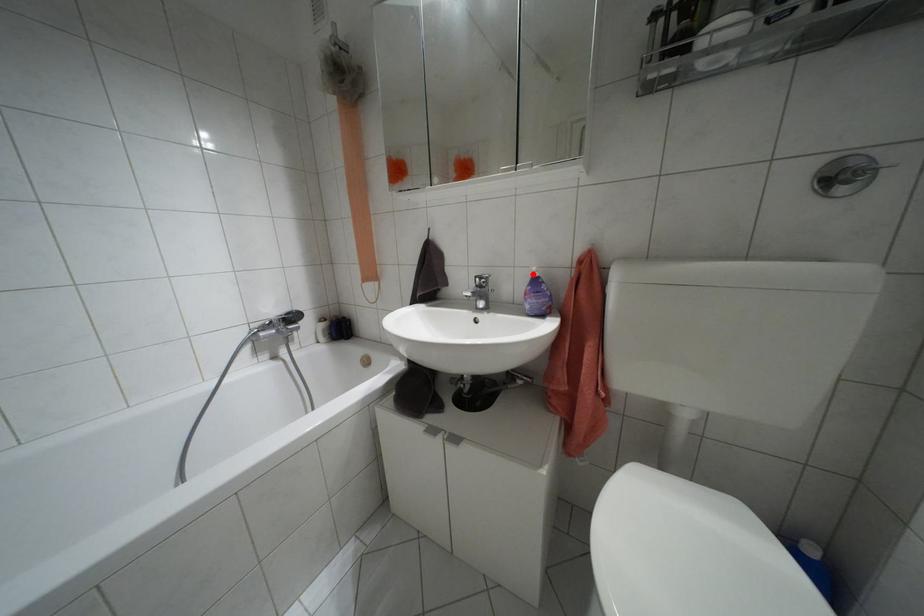
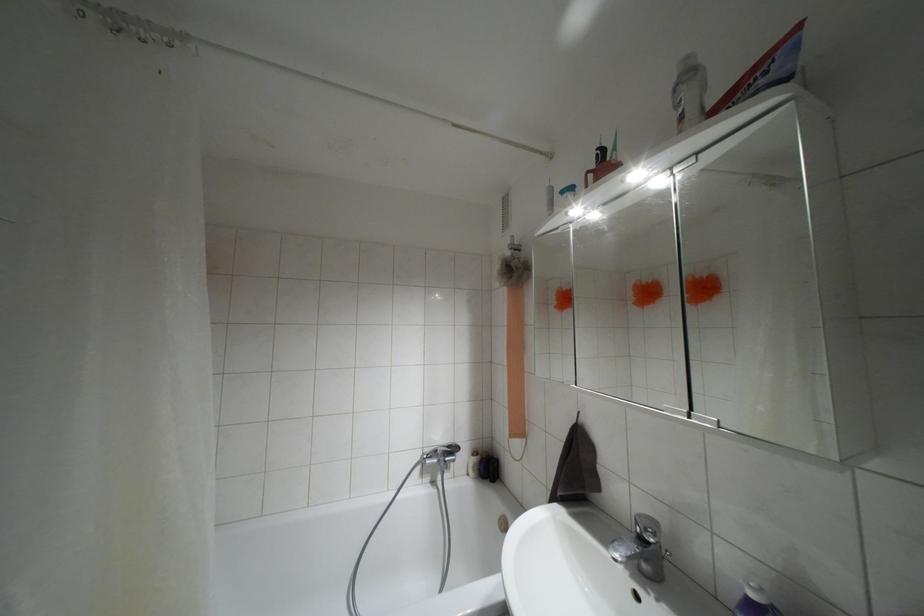
Where in the second image is the point corresponding to the highlighted location from the first image?

(751, 594)